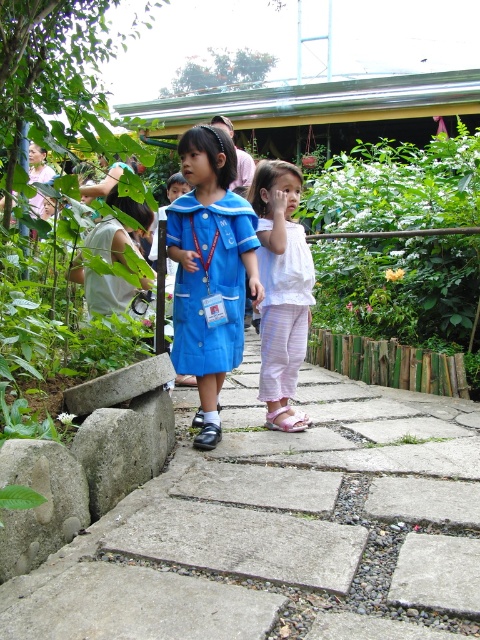
You are a photographer trying to capture a clear shot of both the concrete paving stones at center and the blue fabric dress at center in the same frame. Based on their positions, which object should you focus on first to ensure both are in focus?

You should focus on the concrete paving stones at center first because it is in front of the blue fabric dress at center, so adjusting focus starting from the closer object will help ensure both are in focus.

You are standing at the center of the image. Where is the concrete paving stones at center located in terms of coordinates?

The concrete paving stones at center are located at coordinates point (283, 529).

You are a photographer standing on the concrete paving stones at center and want to take a photo of the blue fabric dress at center. Will the dress be visible in your photo if you point the camera straight ahead?

The concrete paving stones at center are positioned under the blue fabric dress at center, so the dress will be visible in the photo as it is above the stones.